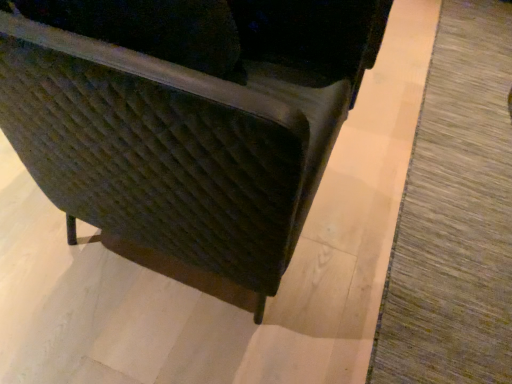
What do you see at coordinates (186, 117) in the screenshot? The width and height of the screenshot is (512, 384). I see `black quilted fabric chair at center` at bounding box center [186, 117].

Find the location of a particular element. black quilted fabric chair at center is located at coordinates click(x=186, y=117).

Image resolution: width=512 pixels, height=384 pixels. I want to click on black quilted fabric chair at center, so click(x=186, y=117).